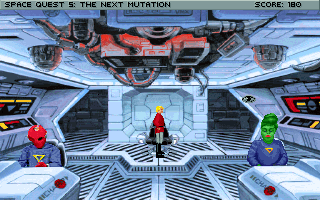
At what (x,y) coordinates should I click in order to perform the action: click on slotted flooring. Please return your answer as a coordinate pair (x, y). The image size is (320, 200). Looking at the image, I should click on (117, 187), (193, 182), (230, 170), (227, 136), (200, 146), (128, 151), (84, 140), (82, 173).